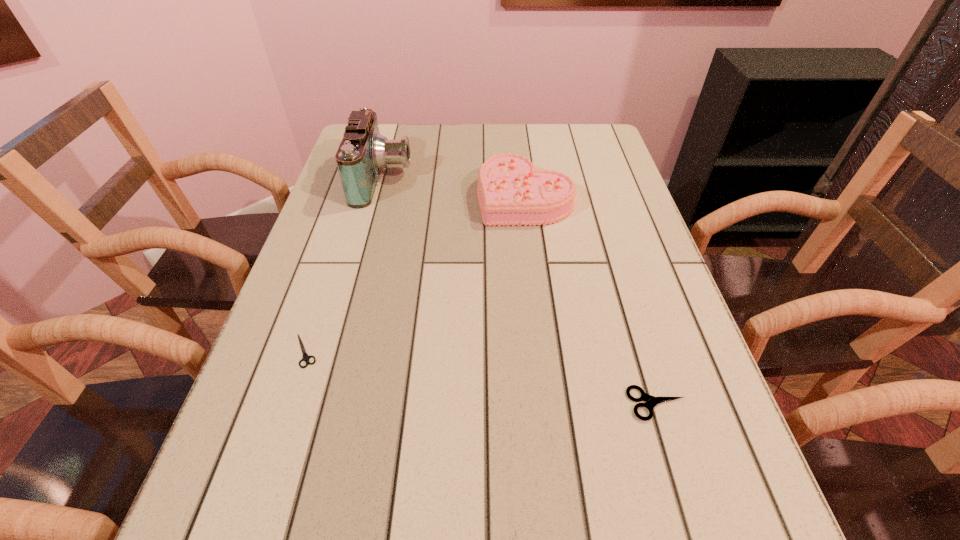
This screenshot has height=540, width=960. What are the coordinates of `vacant area between the camcorder and the rightmost object` in the screenshot? It's located at (520, 292).

Identify which object is the third nearest to the shortest object. Please provide its 2D coordinates. Your answer should be formatted as a tuple, i.e. [(x, y)], where the tuple contains the x and y coordinates of a point satisfying the conditions above.

[(651, 401)]

Identify which object is the nearest to the taller shears. Please provide its 2D coordinates. Your answer should be formatted as a tuple, i.e. [(x, y)], where the tuple contains the x and y coordinates of a point satisfying the conditions above.

[(511, 191)]

Identify the location of free region that satisfies the following two spatial constraints: 1. on the front-facing side of the tallest object; 2. on the left side of the cake. (378, 197).

Where is `free space that satisfies the following two spatial constraints: 1. on the back side of the third shortest object; 2. on the left side of the second nearest object`? The width and height of the screenshot is (960, 540). free space that satisfies the following two spatial constraints: 1. on the back side of the third shortest object; 2. on the left side of the second nearest object is located at coordinates (356, 197).

You are a GUI agent. You are given a task and a screenshot of the screen. Output one action in this format:
    pyautogui.click(x=<x>, y=<y>)
    Task: Click on the vacant space that satisfies the following two spatial constraints: 1. on the front side of the second nearest object; 2. on the left side of the nearer shears
    The width and height of the screenshot is (960, 540).
    Given the screenshot: What is the action you would take?
    pyautogui.click(x=288, y=404)

Image resolution: width=960 pixels, height=540 pixels. I want to click on free point that satisfies the following two spatial constraints: 1. on the back side of the second tallest object; 2. on the left side of the left shears, so click(356, 197).

Identify the location of free location that satisfies the following two spatial constraints: 1. on the front-facing side of the second tallest object; 2. on the right side of the tallest object. click(x=378, y=197).

The height and width of the screenshot is (540, 960). What are the coordinates of `vacant space that satisfies the following two spatial constraints: 1. on the front-facing side of the second shortest object; 2. on the right side of the camcorder` in the screenshot? It's located at (324, 404).

Locate an element on the screen. The height and width of the screenshot is (540, 960). free space in the image that satisfies the following two spatial constraints: 1. on the front-facing side of the tallest object; 2. on the right side of the nearer shears is located at coordinates (324, 404).